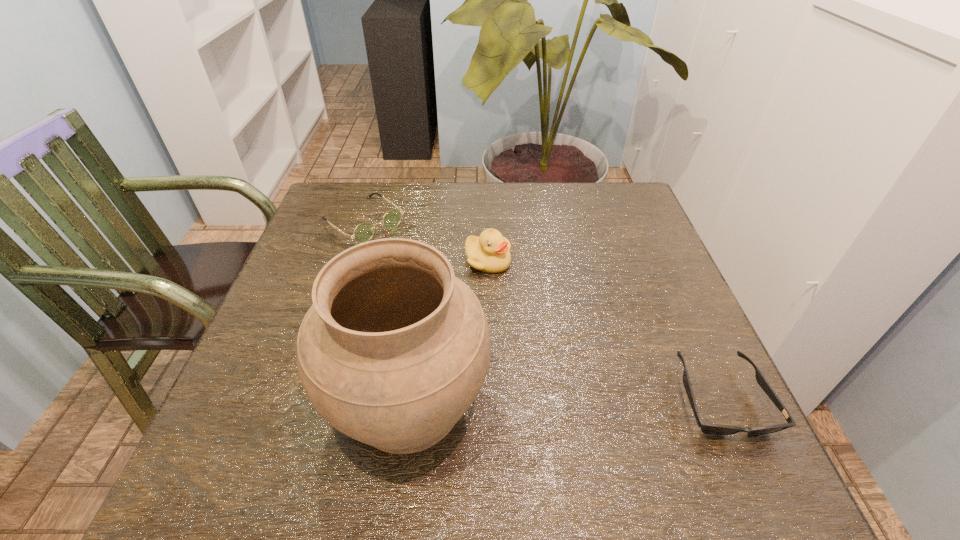
I want to click on urn, so click(x=394, y=350).

Locate an element on the screen. The height and width of the screenshot is (540, 960). the shortest object is located at coordinates (714, 429).

What are the coordinates of `sunglasses` in the screenshot? It's located at (714, 429).

At what (x,y) coordinates should I click in order to perform the action: click on duckling. Please return your answer as a coordinate pair (x, y). Looking at the image, I should click on (490, 252).

This screenshot has width=960, height=540. Identify the location of the second shortest object. pos(364,231).

At what (x,y) coordinates should I click in order to perform the action: click on free space located on the right of the urn. Please return your answer as a coordinate pair (x, y). The width and height of the screenshot is (960, 540). Looking at the image, I should click on (567, 403).

Where is `vacant space located on the front-facing side of the duckling`? vacant space located on the front-facing side of the duckling is located at coordinates (540, 357).

Locate an element on the screen. Image resolution: width=960 pixels, height=540 pixels. vacant space located on the front-facing side of the duckling is located at coordinates (510, 302).

Locate an element on the screen. blank area located 0.400m on the front-facing side of the duckling is located at coordinates (575, 424).

Find the location of `free region located 0.370m on the lenses of the spectacles`. free region located 0.370m on the lenses of the spectacles is located at coordinates (487, 319).